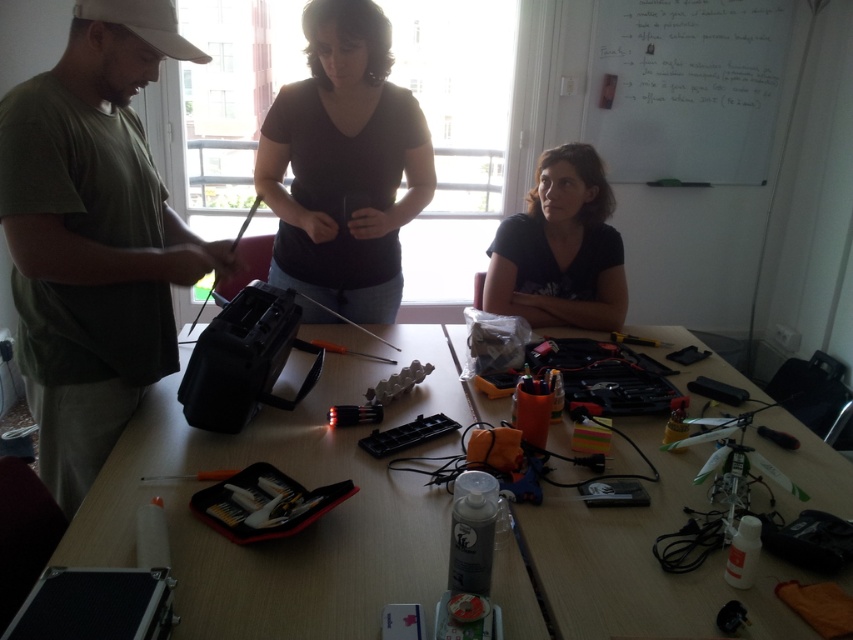
Question: Where is dark matte shirt at center located in relation to black plastic toolbox at center in the image?

Choices:
 (A) right
 (B) left

Answer: (A)

Question: Can you confirm if dark matte shirt at center is positioned to the right of white matte baseball hat at upper left?

Choices:
 (A) no
 (B) yes

Answer: (B)

Question: Does dark matte shirt at center have a lesser width compared to white matte baseball hat at upper left?

Choices:
 (A) yes
 (B) no

Answer: (B)

Question: Considering the real-world distances, which object is farthest from the dark matte shirt at center?

Choices:
 (A) white matte baseball hat at upper left
 (B) black plastic toolbox at center

Answer: (A)

Question: Estimate the real-world distances between objects in this image. Which object is closer to the dark blue t-shirt at center?

Choices:
 (A) black plastic toolbox at center
 (B) wooden table at center
 (C) dark matte shirt at center
 (D) green matte shirt at left

Answer: (C)

Question: Estimate the real-world distances between objects in this image. Which object is farther from the dark matte shirt at center?

Choices:
 (A) dark blue t-shirt at center
 (B) wooden table at center
 (C) white matte baseball hat at upper left

Answer: (B)